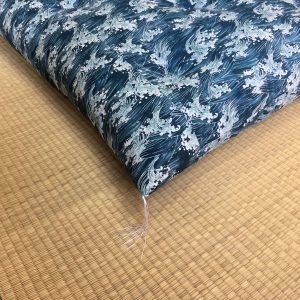
This screenshot has width=300, height=300. Find the location of `wooden tabletop`. wooden tabletop is located at coordinates (0, 298).